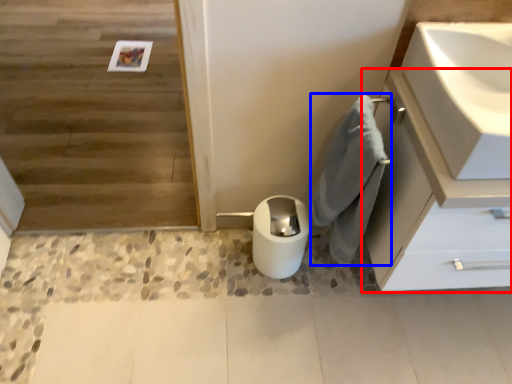
Question: Which object is closer to the camera taking this photo, bathroom cabinet (highlighted by a red box) or bath towel (highlighted by a blue box)?

Choices:
 (A) bathroom cabinet
 (B) bath towel

Answer: (A)